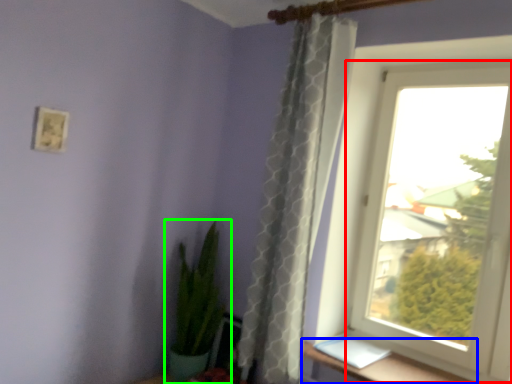
Question: Based on their relative distances, which object is nearer to window (highlighted by a red box)? Choose from window sill (highlighted by a blue box) and houseplant (highlighted by a green box).

Choices:
 (A) window sill
 (B) houseplant

Answer: (A)